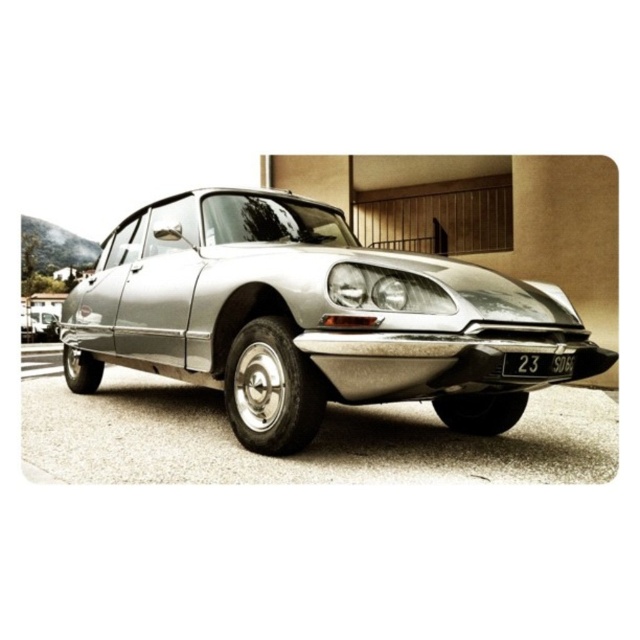
Question: Which object is closer to the camera taking this photo?

Choices:
 (A) black plastic license plate at center
 (B) shiny silver car at center

Answer: (A)

Question: Based on their relative distances, which object is nearer to the silver metallic car at center?

Choices:
 (A) shiny silver car at center
 (B) satin chrome headlight at center

Answer: (B)

Question: Is silver metallic car at center positioned before satin chrome headlight at center?

Choices:
 (A) no
 (B) yes

Answer: (B)

Question: Does silver metallic car at center appear on the left side of satin chrome headlight at center?

Choices:
 (A) no
 (B) yes

Answer: (B)

Question: Which object is farther from the camera taking this photo?

Choices:
 (A) black plastic license plate at center
 (B) satin chrome headlight at center

Answer: (B)

Question: Does silver metallic car at center appear on the left side of black plastic license plate at center?

Choices:
 (A) no
 (B) yes

Answer: (B)